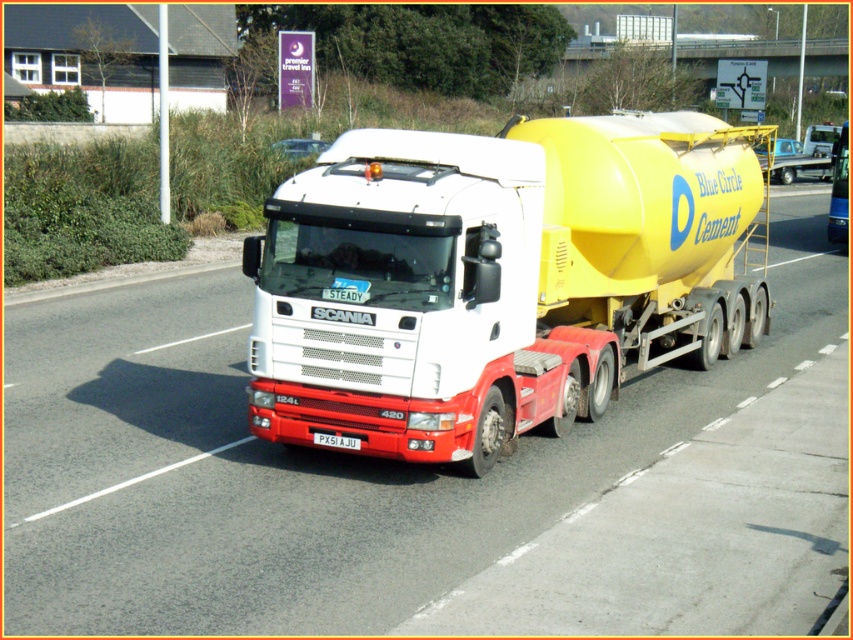
Question: Which object is the closest to the white plastic license plate at center?

Choices:
 (A) white glossy concrete mixer truck at center
 (B) yellow matte cement tank at center

Answer: (A)

Question: Does white glossy concrete mixer truck at center have a smaller size compared to white plastic license plate at center?

Choices:
 (A) yes
 (B) no

Answer: (B)

Question: Which is farther from the white glossy concrete mixer truck at center?

Choices:
 (A) white plastic license plate at center
 (B) yellow matte cement tank at center

Answer: (A)

Question: Does yellow matte cement tank at center appear over white glossy concrete mixer truck at center?

Choices:
 (A) no
 (B) yes

Answer: (B)

Question: Which object is the closest to the white glossy concrete mixer truck at center?

Choices:
 (A) white plastic license plate at center
 (B) yellow matte cement tank at center

Answer: (B)

Question: Considering the relative positions of white glossy concrete mixer truck at center and white plastic license plate at center in the image provided, where is white glossy concrete mixer truck at center located with respect to white plastic license plate at center?

Choices:
 (A) below
 (B) above

Answer: (B)